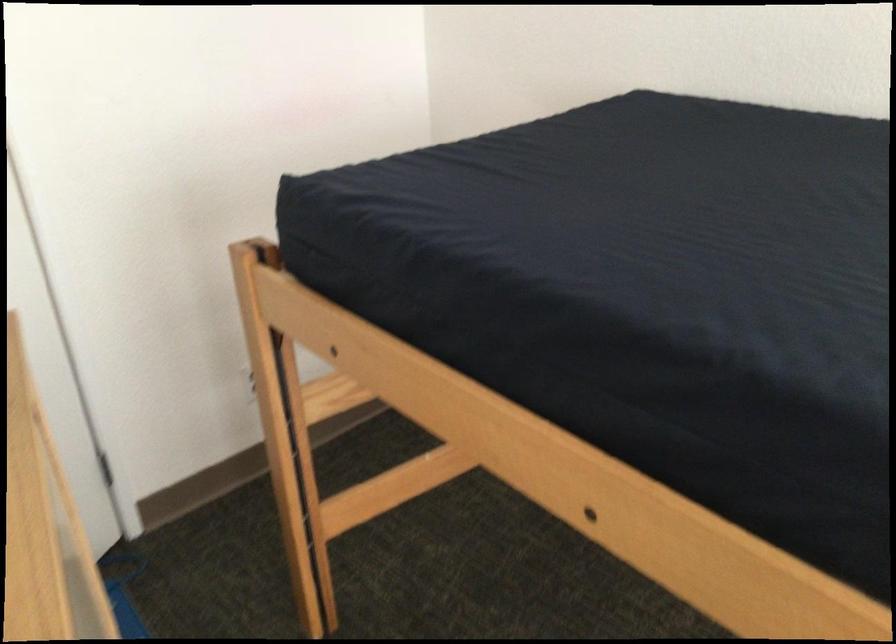
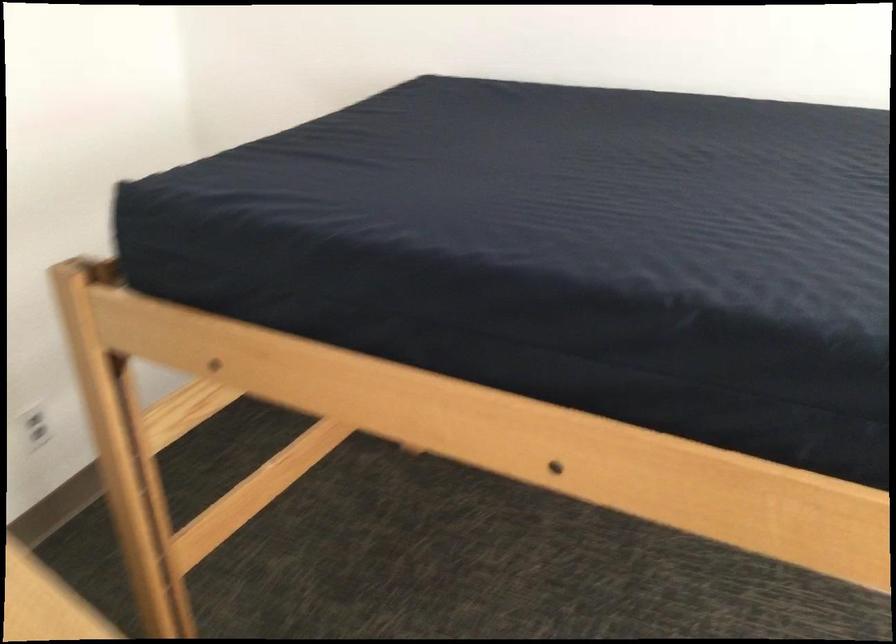
Question: The camera is either moving clockwise (left) or counter-clockwise (right) around the object. The first image is from the beginning of the video and the second image is from the end. Is the camera moving left or right when shooting the video?

Choices:
 (A) Left
 (B) Right

Answer: (A)